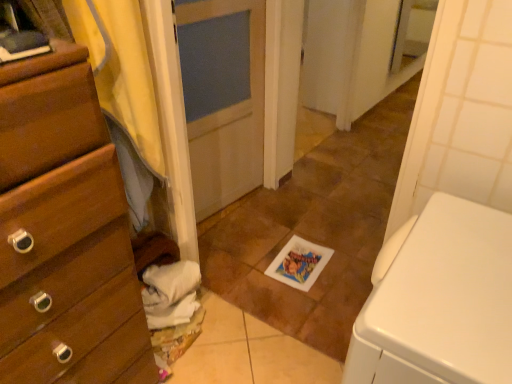
Question: Is the surface of yellow fabric at left in direct contact with white glossy tile at center?

Choices:
 (A) no
 (B) yes

Answer: (A)

Question: Considering the relative sizes of yellow fabric at left and white glossy tile at center in the image provided, is yellow fabric at left wider than white glossy tile at center?

Choices:
 (A) yes
 (B) no

Answer: (B)

Question: Is yellow fabric at left located outside white glossy tile at center?

Choices:
 (A) no
 (B) yes

Answer: (B)

Question: From a real-world perspective, is yellow fabric at left located beneath white glossy tile at center?

Choices:
 (A) yes
 (B) no

Answer: (B)

Question: From the image's perspective, is yellow fabric at left beneath white glossy tile at center?

Choices:
 (A) no
 (B) yes

Answer: (B)

Question: Is yellow fabric at left thinner than white glossy tile at center?

Choices:
 (A) no
 (B) yes

Answer: (B)

Question: Is white glossy tile at center shorter than wooden chest of drawers at left?

Choices:
 (A) no
 (B) yes

Answer: (B)

Question: Is white glossy tile at center wider than wooden chest of drawers at left?

Choices:
 (A) no
 (B) yes

Answer: (B)

Question: From a real-world perspective, is white glossy tile at center under wooden chest of drawers at left?

Choices:
 (A) no
 (B) yes

Answer: (B)

Question: From the image's perspective, is white glossy tile at center located above wooden chest of drawers at left?

Choices:
 (A) yes
 (B) no

Answer: (A)

Question: Is white glossy tile at center turned away from wooden chest of drawers at left?

Choices:
 (A) no
 (B) yes

Answer: (A)

Question: Is white glossy tile at center to the left of wooden chest of drawers at left from the viewer's perspective?

Choices:
 (A) yes
 (B) no

Answer: (B)

Question: Can you confirm if white glossy tile at center is bigger than white cotton towels at lower left?

Choices:
 (A) no
 (B) yes

Answer: (B)